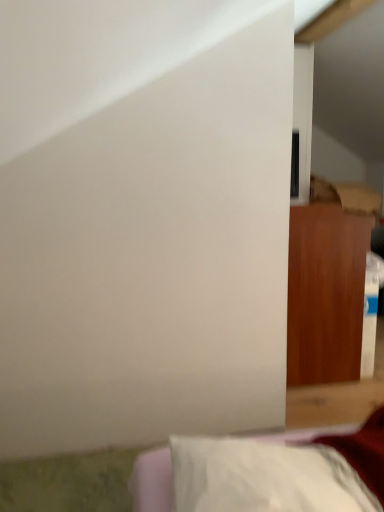
Question: From a real-world perspective, is wooden cabinet at right, positioned as the first furniture in right-to-left order, positioned above or below white fabric pillow at lower right, which appears as the first furniture when viewed from the front?

Choices:
 (A) below
 (B) above

Answer: (B)

Question: In the image, is wooden cabinet at right, positioned as the first furniture in right-to-left order, positioned in front of or behind white fabric pillow at lower right, the 2th furniture in the back-to-front sequence?

Choices:
 (A) front
 (B) behind

Answer: (B)

Question: Is wooden cabinet at right, positioned as the first furniture in right-to-left order, bigger or smaller than white fabric pillow at lower right, the 2th furniture in the back-to-front sequence?

Choices:
 (A) big
 (B) small

Answer: (A)

Question: Considering the positions of white fabric pillow at lower right, which appears as the first furniture when viewed from the front, and wooden cabinet at right, placed as the 1th furniture when sorted from top to bottom, in the image, is white fabric pillow at lower right, which appears as the first furniture when viewed from the front, taller or shorter than wooden cabinet at right, placed as the 1th furniture when sorted from top to bottom,?

Choices:
 (A) tall
 (B) short

Answer: (B)

Question: Based on their sizes in the image, would you say white fabric pillow at lower right, which appears as the first furniture when viewed from the front, is bigger or smaller than wooden cabinet at right, placed as the 1th furniture when sorted from top to bottom?

Choices:
 (A) small
 (B) big

Answer: (A)

Question: Based on their positions, is white fabric pillow at lower right, marked as the first furniture in a left-to-right arrangement, located to the left or right of wooden cabinet at right, positioned as the first furniture in right-to-left order?

Choices:
 (A) left
 (B) right

Answer: (A)

Question: Does point (150, 463) appear closer or farther from the camera than point (349, 298)?

Choices:
 (A) closer
 (B) farther

Answer: (A)